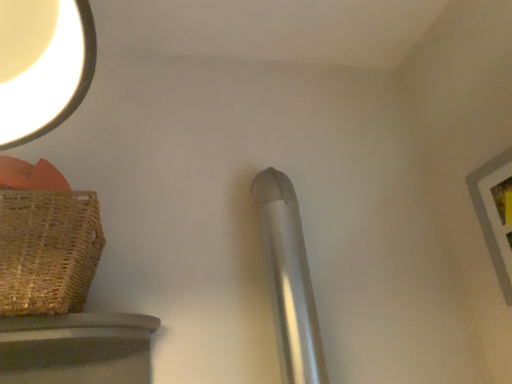
Question: From the image's perspective, is silver metallic pipe at center located above or below brown woven basket at left?

Choices:
 (A) below
 (B) above

Answer: (A)

Question: Looking at the image, does silver metallic pipe at center seem bigger or smaller compared to brown woven basket at left?

Choices:
 (A) big
 (B) small

Answer: (B)

Question: Which object is the closest to the silver metallic pipe at center?

Choices:
 (A) wooden picture frame at upper right
 (B) brown woven basket at left

Answer: (B)

Question: Which is farther from the wooden picture frame at upper right?

Choices:
 (A) brown woven basket at left
 (B) silver metallic pipe at center

Answer: (A)